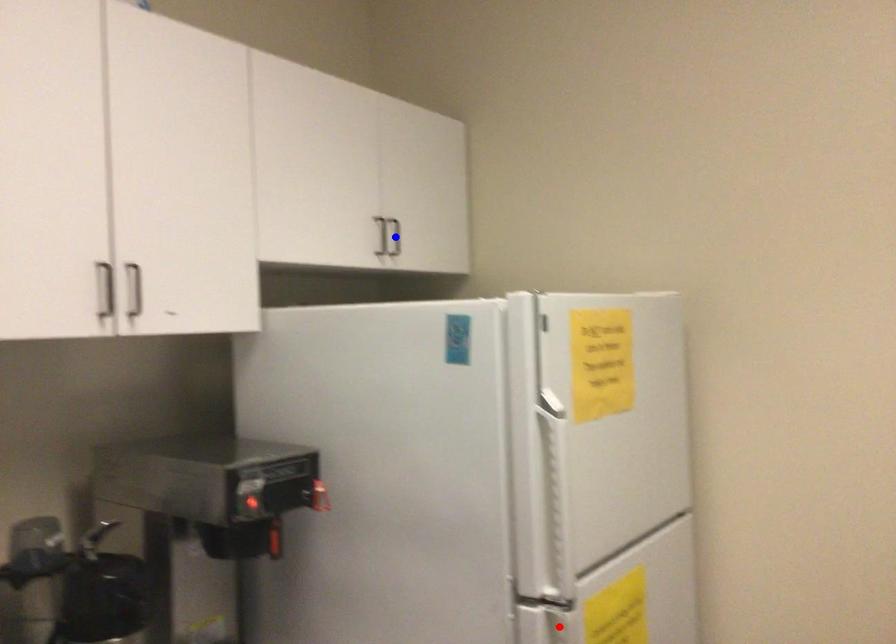
Question: Two points are marked on the image. Which point is closer to the camera?

Choices:
 (A) Blue point is closer.
 (B) Red point is closer.

Answer: (B)